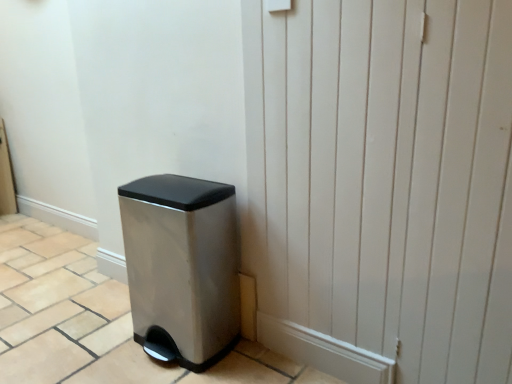
Identify the location of free space to the left of satin silver trash can at lower left. The height and width of the screenshot is (384, 512). point(94,344).